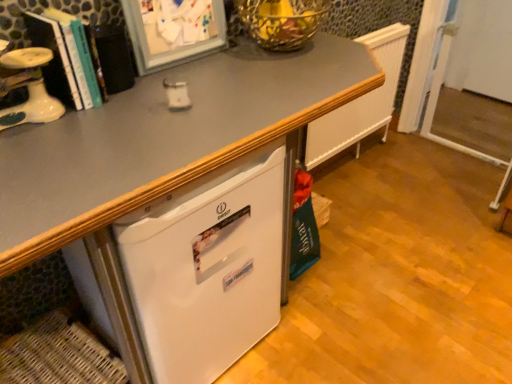
At what (x,y) coordinates should I click in order to perform the action: click on free space in front of hardcover book at left. Please return your answer as a coordinate pair (x, y). Looking at the image, I should click on (86, 128).